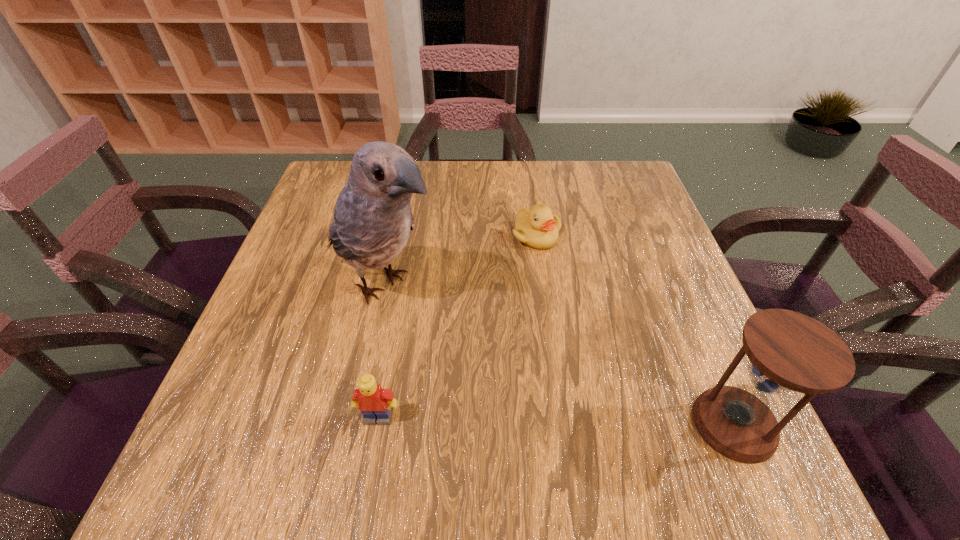
Locate an element on the screen. Image resolution: width=960 pixels, height=540 pixels. vacant space on the desktop that is between the Lego and the hourglass and is positioned on the front-facing side of the farthest object is located at coordinates (563, 421).

At what (x,y) coordinates should I click in order to perform the action: click on free spot on the desktop that is between the Lego and the third shortest object and is positioned on the front-facing side of the second farthest object. Please return your answer as a coordinate pair (x, y). Looking at the image, I should click on (599, 422).